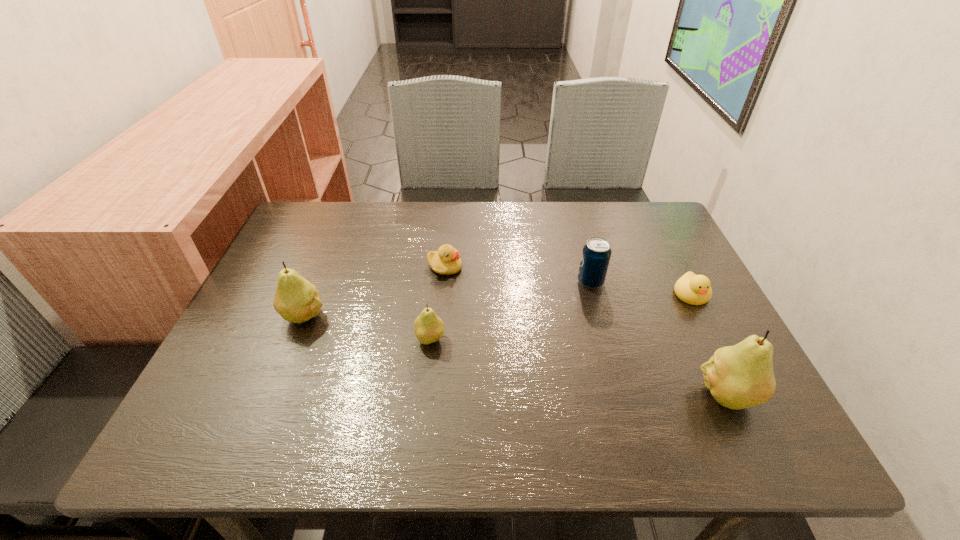
Image resolution: width=960 pixels, height=540 pixels. Identify the location of free space at the left edge. (273, 257).

Image resolution: width=960 pixels, height=540 pixels. Find the location of `vacant space at the right edge`. vacant space at the right edge is located at coordinates (670, 263).

The height and width of the screenshot is (540, 960). Identify the location of free space at the near left corner. (226, 407).

Identify the location of vacant area at the far right corner of the desktop. (646, 238).

Where is `free space between the left duckling and the soda can`? Image resolution: width=960 pixels, height=540 pixels. free space between the left duckling and the soda can is located at coordinates (517, 274).

This screenshot has width=960, height=540. What are the coordinates of `vacant area that lies between the nearer duckling and the fourth object from left to right` in the screenshot? It's located at (641, 288).

This screenshot has width=960, height=540. Find the location of `empty location between the second pear from left to right and the nearest pear`. empty location between the second pear from left to right and the nearest pear is located at coordinates (579, 367).

Find the location of a particular element. The height and width of the screenshot is (540, 960). free space between the nearest object and the second pear from left to right is located at coordinates [x=579, y=367].

The image size is (960, 540). Find the location of `vacant area that lies between the second pear from right to left and the right duckling`. vacant area that lies between the second pear from right to left and the right duckling is located at coordinates (561, 316).

Identify the location of empty location between the leftmost pear and the nearer duckling. (498, 305).